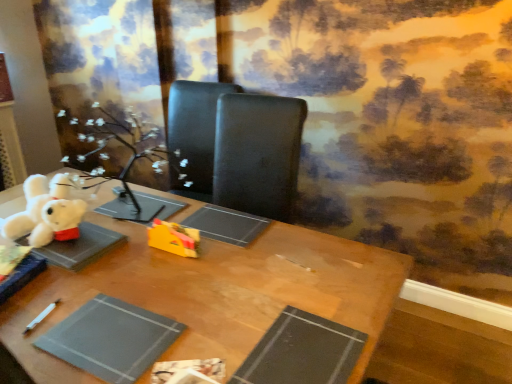
Find the location of a particular element. vacant space to the right of white plush bear at upper left, arranged as the 1th toy when viewed from the left is located at coordinates (105, 242).